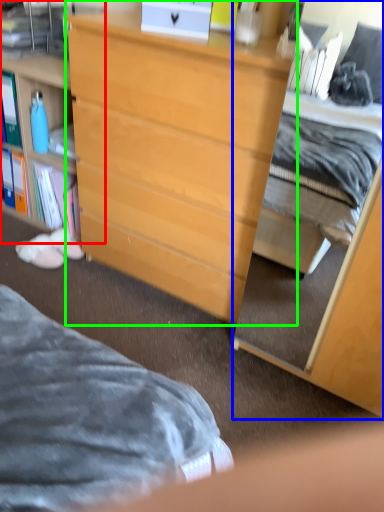
Question: Which is nearer to the cabinetry (highlighted by a red box)? cabinetry (highlighted by a blue box) or desk (highlighted by a green box).

Choices:
 (A) cabinetry
 (B) desk

Answer: (B)